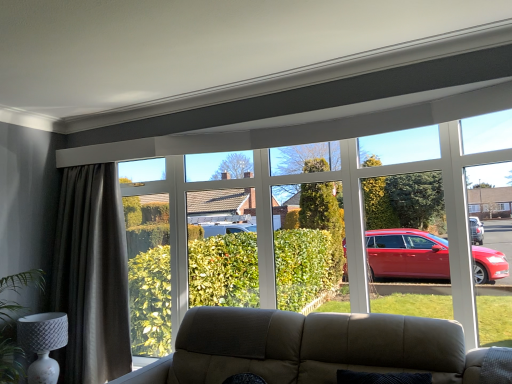
What is the approximate height of dark grey textured curtain at left?

The height of dark grey textured curtain at left is 5.60 feet.

In order to click on white textured lamp at lower left in this screenshot , I will do `click(42, 343)`.

Is white textured lamp at lower left shorter than transparent glass bay window at upper center?

Yes, white textured lamp at lower left is shorter than transparent glass bay window at upper center.

Which is in front, white textured lamp at lower left or transparent glass bay window at upper center?

transparent glass bay window at upper center is in front.

How many degrees apart are the facing directions of white textured lamp at lower left and transparent glass bay window at upper center?

92.6 degrees separate the facing orientations of white textured lamp at lower left and transparent glass bay window at upper center.

Which object is positioned more to the left, white textured lamp at lower left or transparent glass bay window at upper center?

Positioned to the left is white textured lamp at lower left.

Is point (56, 226) more distant than point (31, 369)?

Yes, point (56, 226) is farther from viewer.

Looking at this image, how different are the orientations of dark grey textured curtain at left and white textured lamp at lower left in degrees?

They differ by 93.9 degrees in their facing directions.

Could you tell me if dark grey textured curtain at left is turned towards white textured lamp at lower left?

Yes, dark grey textured curtain at left is oriented towards white textured lamp at lower left.

How different are the orientations of transparent glass bay window at upper center and dark grey textured curtain at left in degrees?

They differ by 1.31 degrees in their facing directions.

Can you see transparent glass bay window at upper center touching dark grey textured curtain at left?

No, transparent glass bay window at upper center is not touching dark grey textured curtain at left.

Image resolution: width=512 pixels, height=384 pixels. What are the coordinates of `curtain below the transparent glass bay window at upper center (from a real-world perspective)` in the screenshot? It's located at (91, 276).

Would you say transparent glass bay window at upper center contains dark grey textured curtain at left?

No, dark grey textured curtain at left is not surrounded by transparent glass bay window at upper center.

From the image's perspective, would you say dark grey textured curtain at left is shown under transparent glass bay window at upper center?

Indeed, from the image's perspective, dark grey textured curtain at left is shown beneath transparent glass bay window at upper center.

Is dark grey textured curtain at left placed right next to transparent glass bay window at upper center?

No, dark grey textured curtain at left is not making contact with transparent glass bay window at upper center.

Between dark grey textured curtain at left and transparent glass bay window at upper center, which one appears on the left side from the viewer's perspective?

dark grey textured curtain at left is more to the left.

Locate an element on the screen. curtain that appears behind the white textured lamp at lower left is located at coordinates (91, 276).

Is white textured lamp at lower left not inside dark grey textured curtain at left?

That's correct, white textured lamp at lower left is outside of dark grey textured curtain at left.

Considering the positions of objects white textured lamp at lower left and dark grey textured curtain at left in the image provided, who is more to the right, white textured lamp at lower left or dark grey textured curtain at left?

Positioned to the right is dark grey textured curtain at left.

What's the angular difference between white textured lamp at lower left and dark grey textured curtain at left's facing directions?

The angle between the facing direction of white textured lamp at lower left and the facing direction of dark grey textured curtain at left is 93.9 degrees.

Where is `bay window above the white textured lamp at lower left (from the image's perspective)`? This screenshot has height=384, width=512. bay window above the white textured lamp at lower left (from the image's perspective) is located at coordinates (313, 235).

Looking at the image, does transparent glass bay window at upper center seem bigger or smaller compared to white textured lamp at lower left?

transparent glass bay window at upper center is bigger than white textured lamp at lower left.

Does transparent glass bay window at upper center lie behind white textured lamp at lower left?

No, transparent glass bay window at upper center is closer to the viewer.

The width and height of the screenshot is (512, 384). In order to click on lamp behind the transparent glass bay window at upper center in this screenshot , I will do click(x=42, y=343).

Find the location of a particular element. The height and width of the screenshot is (384, 512). curtain on the right side of white textured lamp at lower left is located at coordinates click(x=91, y=276).

When comparing their distances from dark grey textured curtain at left, does transparent glass bay window at upper center or white textured lamp at lower left seem closer?

Among the two, white textured lamp at lower left is located nearer to dark grey textured curtain at left.

Consider the image. Based on their spatial positions, is white textured lamp at lower left or transparent glass bay window at upper center closer to dark grey textured curtain at left?

white textured lamp at lower left is closer to dark grey textured curtain at left.

Based on their spatial positions, is dark grey textured curtain at left or transparent glass bay window at upper center closer to white textured lamp at lower left?

The object closer to white textured lamp at lower left is dark grey textured curtain at left.

Looking at this image, looking at the image, which one is located further to transparent glass bay window at upper center, white textured lamp at lower left or dark grey textured curtain at left?

Among the two, white textured lamp at lower left is located further to transparent glass bay window at upper center.

Based on the photo, when comparing their distances from white textured lamp at lower left, does transparent glass bay window at upper center or dark grey textured curtain at left seem closer?

dark grey textured curtain at left.

Based on their spatial positions, is dark grey textured curtain at left or white textured lamp at lower left further from transparent glass bay window at upper center?

Based on the image, white textured lamp at lower left appears to be further to transparent glass bay window at upper center.

Locate an element on the screen. curtain between white textured lamp at lower left and transparent glass bay window at upper center from left to right is located at coordinates (91, 276).